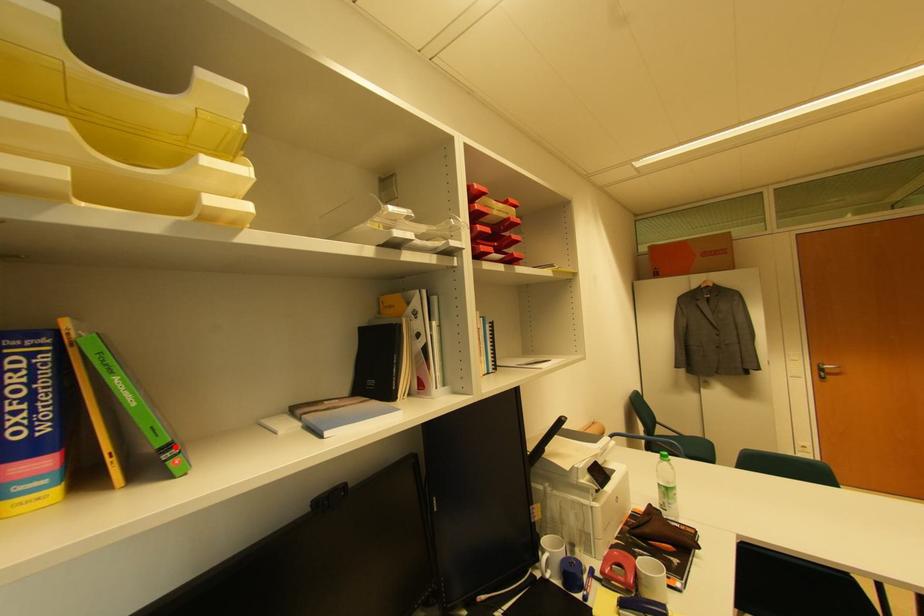
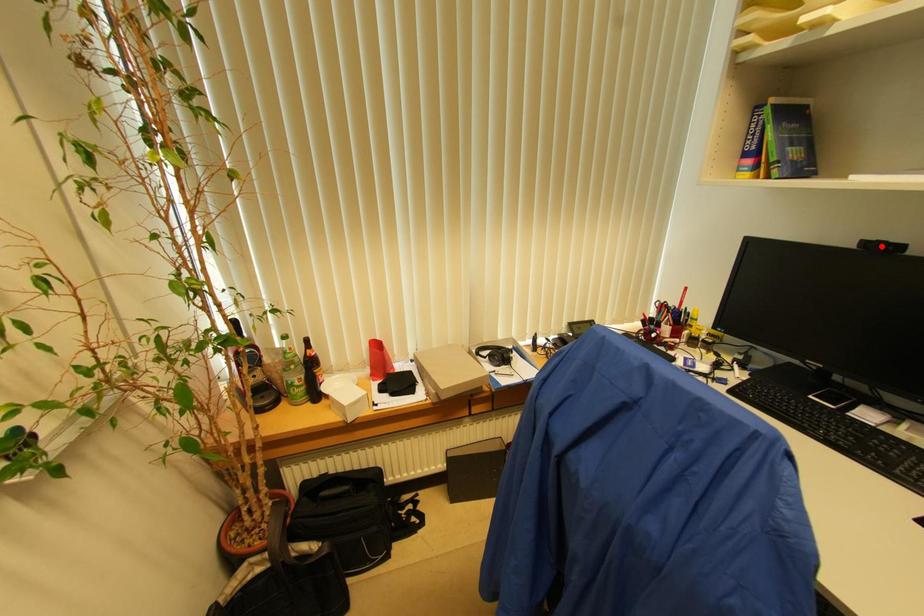
I am providing you with two images of the same scene from different viewpoints. A red point is marked on the first image and another point is marked on the second image. Is the red point in image1 aligned with the point shown in image2?

No